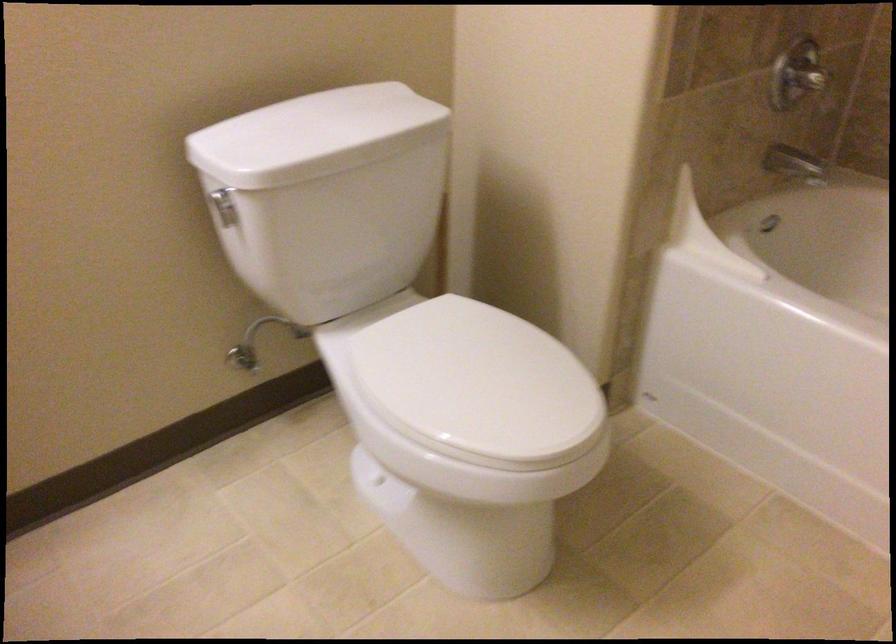
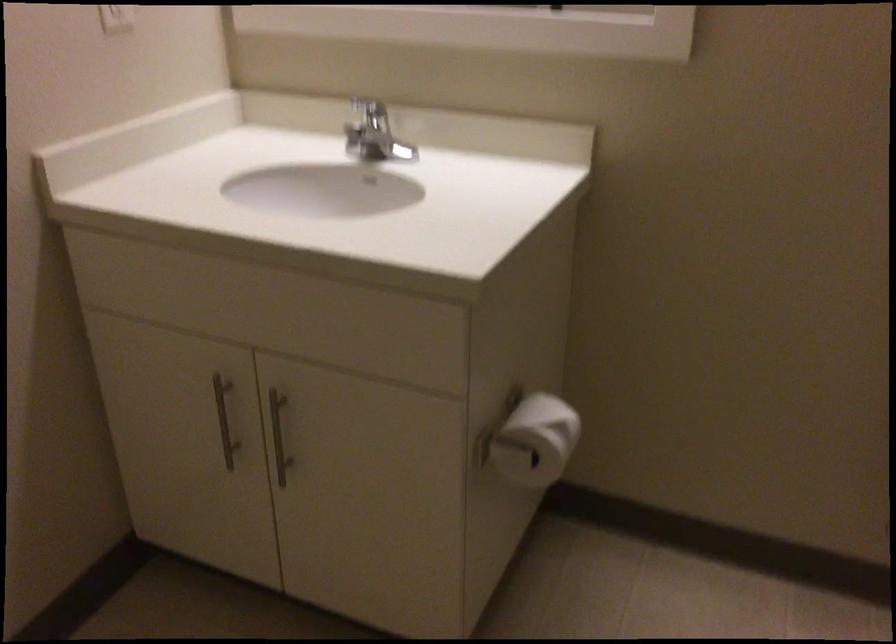
Question: The camera is either moving clockwise (left) or counter-clockwise (right) around the object. The first image is from the beginning of the video and the second image is from the end. Is the camera moving left or right when shooting the video?

Choices:
 (A) Left
 (B) Right

Answer: (B)